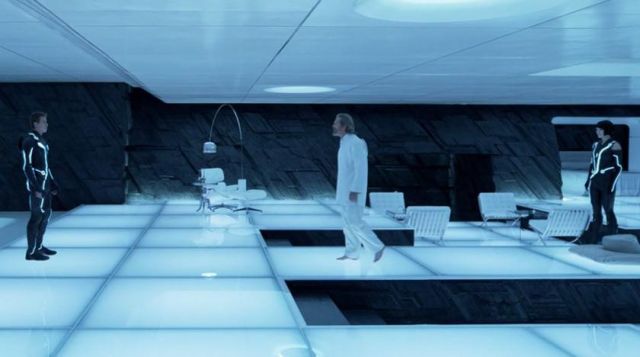
At what (x,y) coordinates should I click in order to perform the action: click on chair. Please return your answer as a coordinate pair (x, y). Looking at the image, I should click on (214, 178), (432, 227), (394, 204), (504, 198), (557, 226).